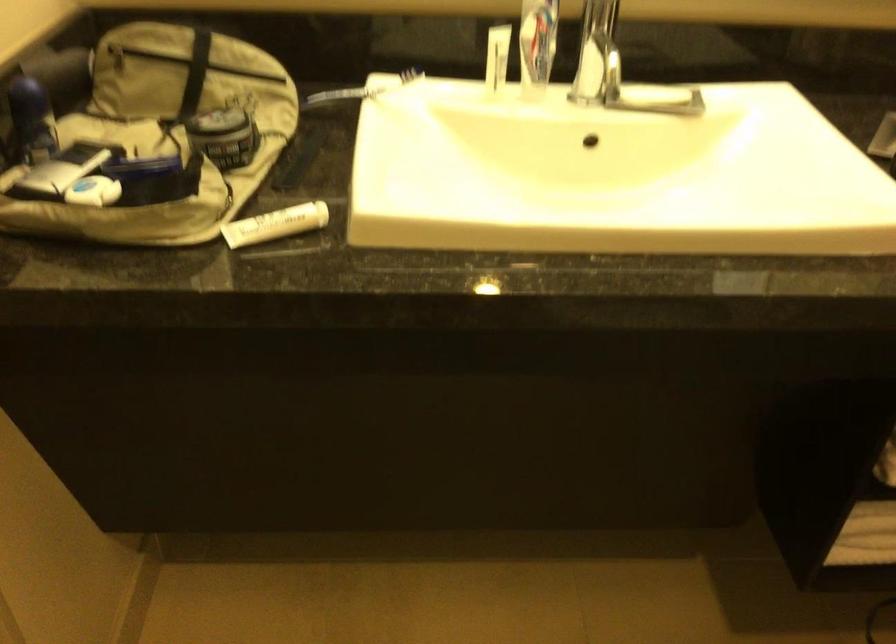
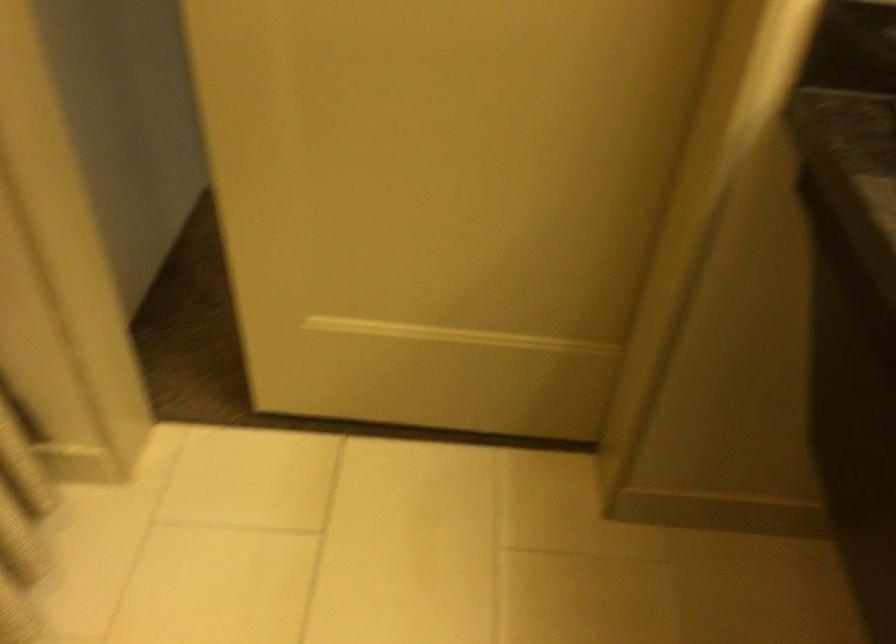
In the scene shown: Based on the continuous images, in which direction is the camera rotating?

The rotation direction of the camera is left-down.